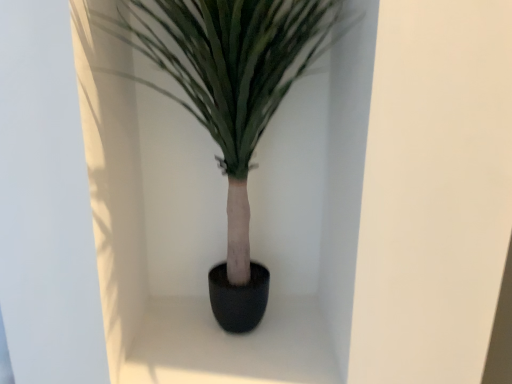
Where is `vacant area situated below green matte plant at center (from a real-world perspective)`? The image size is (512, 384). vacant area situated below green matte plant at center (from a real-world perspective) is located at coordinates (233, 343).